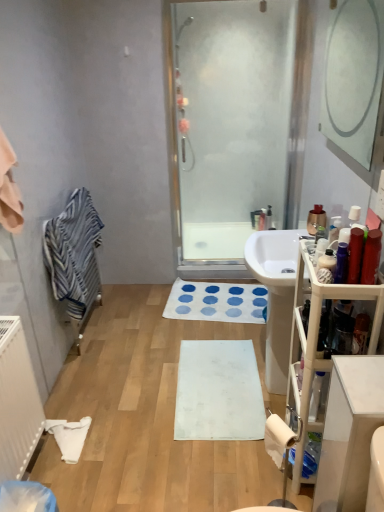
Question: Is white matte rug at center completely or partially inside shiny purple bottle at right, marked as the 4th toiletry in a right-to-left arrangement?

Choices:
 (A) yes
 (B) no

Answer: (B)

Question: From the image's perspective, does shiny purple bottle at right, marked as the 4th toiletry in a right-to-left arrangement, appear higher than white matte rug at center?

Choices:
 (A) yes
 (B) no

Answer: (A)

Question: Is shiny purple bottle at right, marked as the 4th toiletry in a right-to-left arrangement, at the right side of white matte rug at center?

Choices:
 (A) no
 (B) yes

Answer: (B)

Question: From a real-world perspective, is shiny purple bottle at right, the third toiletry viewed from the back, beneath white matte rug at center?

Choices:
 (A) no
 (B) yes

Answer: (A)

Question: Is shiny purple bottle at right, which appears as the 2th toiletry when viewed from the left, aimed at white matte rug at center?

Choices:
 (A) yes
 (B) no

Answer: (B)

Question: Does shiny purple bottle at right, marked as the 4th toiletry in a right-to-left arrangement, have a greater height compared to white matte rug at center?

Choices:
 (A) yes
 (B) no

Answer: (A)

Question: Could you tell me if transparent glass shower door at center is turned towards white glossy cabinet at right?

Choices:
 (A) no
 (B) yes

Answer: (B)

Question: From a real-world perspective, is transparent glass shower door at center over white glossy cabinet at right?

Choices:
 (A) no
 (B) yes

Answer: (B)

Question: Is transparent glass shower door at center positioned before white glossy cabinet at right?

Choices:
 (A) no
 (B) yes

Answer: (A)

Question: From the image's perspective, is transparent glass shower door at center above white glossy cabinet at right?

Choices:
 (A) no
 (B) yes

Answer: (B)

Question: Is transparent glass shower door at center outside white glossy cabinet at right?

Choices:
 (A) yes
 (B) no

Answer: (A)

Question: Is white glossy cabinet at right at the back of transparent glass shower door at center?

Choices:
 (A) no
 (B) yes

Answer: (A)

Question: Considering the relative sizes of white plastic vanity at right and matte silver faucet at center in the image provided, is white plastic vanity at right smaller than matte silver faucet at center?

Choices:
 (A) no
 (B) yes

Answer: (A)